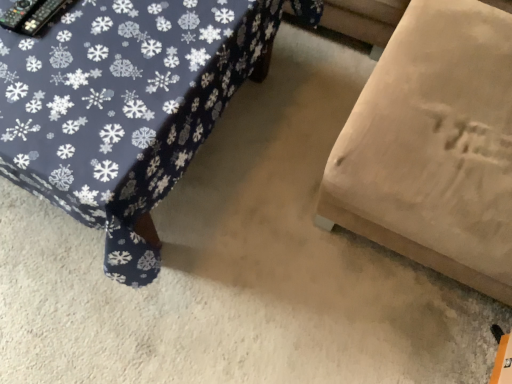
This screenshot has height=384, width=512. What do you see at coordinates (123, 107) in the screenshot?
I see `beige fabric couch at lower right, the first furniture when ordered from left to right` at bounding box center [123, 107].

At what (x,y) coordinates should I click in order to perform the action: click on beige fabric couch at lower right, the first furniture when ordered from left to right. Please return your answer as a coordinate pair (x, y). This screenshot has width=512, height=384. Looking at the image, I should click on (123, 107).

What is the approximate width of beige fabric ottoman at lower right, the 1th furniture viewed from the right?

27.25 inches.

Describe the element at coordinates (433, 146) in the screenshot. Image resolution: width=512 pixels, height=384 pixels. I see `beige fabric ottoman at lower right, which is the second furniture from left to right` at that location.

I want to click on beige fabric ottoman at lower right, the 1th furniture viewed from the right, so click(433, 146).

Locate an element on the screen. Image resolution: width=512 pixels, height=384 pixels. beige fabric couch at lower right, arranged as the second furniture when viewed from the right is located at coordinates (123, 107).

Can you confirm if beige fabric couch at lower right, the first furniture when ordered from left to right, is positioned to the right of beige fabric ottoman at lower right, the 1th furniture viewed from the right?

No.

Considering the relative positions of beige fabric couch at lower right, arranged as the second furniture when viewed from the right, and beige fabric ottoman at lower right, the 1th furniture viewed from the right, in the image provided, is beige fabric couch at lower right, arranged as the second furniture when viewed from the right, behind beige fabric ottoman at lower right, the 1th furniture viewed from the right,?

Yes, beige fabric couch at lower right, arranged as the second furniture when viewed from the right, is further from the camera.

Does point (80, 57) come in front of point (435, 210)?

No, (80, 57) is behind (435, 210).

From the image's perspective, does beige fabric couch at lower right, arranged as the second furniture when viewed from the right, appear lower than beige fabric ottoman at lower right, which is the second furniture from left to right?

Yes, from the image's perspective, beige fabric couch at lower right, arranged as the second furniture when viewed from the right, is beneath beige fabric ottoman at lower right, which is the second furniture from left to right.

From a real-world perspective, is beige fabric couch at lower right, arranged as the second furniture when viewed from the right, located beneath beige fabric ottoman at lower right, which is the second furniture from left to right?

Yes, from a real-world perspective, beige fabric couch at lower right, arranged as the second furniture when viewed from the right, is beneath beige fabric ottoman at lower right, which is the second furniture from left to right.

Does beige fabric couch at lower right, the first furniture when ordered from left to right, have a lesser width compared to beige fabric ottoman at lower right, which is the second furniture from left to right?

Incorrect, the width of beige fabric couch at lower right, the first furniture when ordered from left to right, is not less than that of beige fabric ottoman at lower right, which is the second furniture from left to right.

Who is shorter, beige fabric couch at lower right, the first furniture when ordered from left to right, or beige fabric ottoman at lower right, which is the second furniture from left to right?

beige fabric couch at lower right, the first furniture when ordered from left to right, is shorter.

Looking at this image, considering the sizes of objects beige fabric couch at lower right, arranged as the second furniture when viewed from the right, and beige fabric ottoman at lower right, which is the second furniture from left to right, in the image provided, who is smaller, beige fabric couch at lower right, arranged as the second furniture when viewed from the right, or beige fabric ottoman at lower right, which is the second furniture from left to right,?

beige fabric couch at lower right, arranged as the second furniture when viewed from the right.

From the picture: Is beige fabric couch at lower right, arranged as the second furniture when viewed from the right, not within beige fabric ottoman at lower right, which is the second furniture from left to right?

Yes, beige fabric couch at lower right, arranged as the second furniture when viewed from the right, is outside of beige fabric ottoman at lower right, which is the second furniture from left to right.

Is beige fabric couch at lower right, the first furniture when ordered from left to right, with beige fabric ottoman at lower right, which is the second furniture from left to right?

beige fabric couch at lower right, the first furniture when ordered from left to right, and beige fabric ottoman at lower right, which is the second furniture from left to right, are not in contact.

Does beige fabric couch at lower right, arranged as the second furniture when viewed from the right, turn towards beige fabric ottoman at lower right, the 1th furniture viewed from the right?

No, beige fabric couch at lower right, arranged as the second furniture when viewed from the right, is not oriented towards beige fabric ottoman at lower right, the 1th furniture viewed from the right.

Can you tell me how much beige fabric couch at lower right, the first furniture when ordered from left to right, and beige fabric ottoman at lower right, the 1th furniture viewed from the right, differ in facing direction?

90 degrees separate the facing orientations of beige fabric couch at lower right, the first furniture when ordered from left to right, and beige fabric ottoman at lower right, the 1th furniture viewed from the right.

Measure the distance between beige fabric couch at lower right, arranged as the second furniture when viewed from the right, and beige fabric ottoman at lower right, which is the second furniture from left to right.

The distance of beige fabric couch at lower right, arranged as the second furniture when viewed from the right, from beige fabric ottoman at lower right, which is the second furniture from left to right, is 20.47 inches.

Locate an element on the screen. furniture on the right of beige fabric couch at lower right, arranged as the second furniture when viewed from the right is located at coordinates (433, 146).

Considering the relative positions of beige fabric ottoman at lower right, which is the second furniture from left to right, and beige fabric couch at lower right, the first furniture when ordered from left to right, in the image provided, is beige fabric ottoman at lower right, which is the second furniture from left to right, to the left of beige fabric couch at lower right, the first furniture when ordered from left to right, from the viewer's perspective?

No.

Does beige fabric ottoman at lower right, which is the second furniture from left to right, come in front of beige fabric couch at lower right, arranged as the second furniture when viewed from the right?

That is True.

Considering the points (380, 241) and (42, 118), which point is in front, point (380, 241) or point (42, 118)?

Positioned in front is point (42, 118).

From the image's perspective, who appears lower, beige fabric ottoman at lower right, which is the second furniture from left to right, or beige fabric couch at lower right, the first furniture when ordered from left to right?

From the image's view, beige fabric couch at lower right, the first furniture when ordered from left to right, is below.

From a real-world perspective, between beige fabric ottoman at lower right, which is the second furniture from left to right, and beige fabric couch at lower right, arranged as the second furniture when viewed from the right, who is vertically lower?

From a 3D spatial view, beige fabric couch at lower right, arranged as the second furniture when viewed from the right, is below.

Considering the sizes of objects beige fabric ottoman at lower right, the 1th furniture viewed from the right, and beige fabric couch at lower right, the first furniture when ordered from left to right, in the image provided, who is wider, beige fabric ottoman at lower right, the 1th furniture viewed from the right, or beige fabric couch at lower right, the first furniture when ordered from left to right,?

Wider between the two is beige fabric couch at lower right, the first furniture when ordered from left to right.

Is beige fabric ottoman at lower right, the 1th furniture viewed from the right, shorter than beige fabric couch at lower right, the first furniture when ordered from left to right?

No, beige fabric ottoman at lower right, the 1th furniture viewed from the right, is not shorter than beige fabric couch at lower right, the first furniture when ordered from left to right.

Considering the sizes of objects beige fabric ottoman at lower right, which is the second furniture from left to right, and beige fabric couch at lower right, the first furniture when ordered from left to right, in the image provided, who is bigger, beige fabric ottoman at lower right, which is the second furniture from left to right, or beige fabric couch at lower right, the first furniture when ordered from left to right,?

beige fabric ottoman at lower right, which is the second furniture from left to right.

Would you say beige fabric ottoman at lower right, which is the second furniture from left to right, is inside or outside beige fabric couch at lower right, the first furniture when ordered from left to right?

beige fabric ottoman at lower right, which is the second furniture from left to right, exists outside the volume of beige fabric couch at lower right, the first furniture when ordered from left to right.

Is beige fabric ottoman at lower right, the 1th furniture viewed from the right, not near beige fabric couch at lower right, arranged as the second furniture when viewed from the right?

No, beige fabric ottoman at lower right, the 1th furniture viewed from the right, is not far away from beige fabric couch at lower right, arranged as the second furniture when viewed from the right.

Is beige fabric ottoman at lower right, the 1th furniture viewed from the right, turned away from beige fabric couch at lower right, arranged as the second furniture when viewed from the right?

No, beige fabric ottoman at lower right, the 1th furniture viewed from the right, is not facing the opposite direction of beige fabric couch at lower right, arranged as the second furniture when viewed from the right.

How many degrees apart are the facing directions of beige fabric ottoman at lower right, the 1th furniture viewed from the right, and beige fabric couch at lower right, the first furniture when ordered from left to right?

The angular difference between beige fabric ottoman at lower right, the 1th furniture viewed from the right, and beige fabric couch at lower right, the first furniture when ordered from left to right, is 90 degrees.

Locate an element on the screen. furniture on the right of beige fabric couch at lower right, the first furniture when ordered from left to right is located at coordinates (433, 146).

This screenshot has width=512, height=384. What are the coordinates of `furniture above the beige fabric couch at lower right, arranged as the second furniture when viewed from the right (from a real-world perspective)` in the screenshot? It's located at (433, 146).

Find the location of a particular element. furniture above the beige fabric couch at lower right, arranged as the second furniture when viewed from the right (from the image's perspective) is located at coordinates (433, 146).